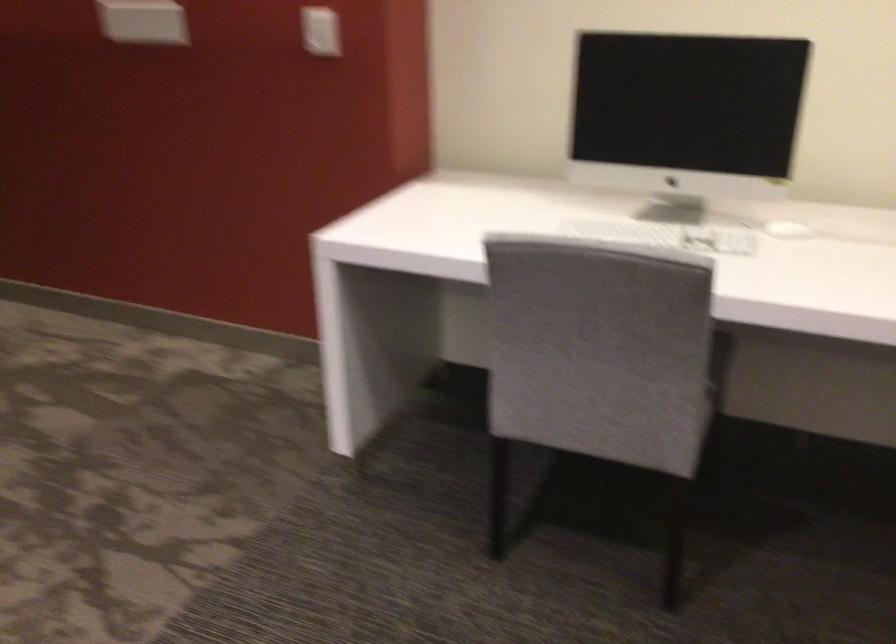
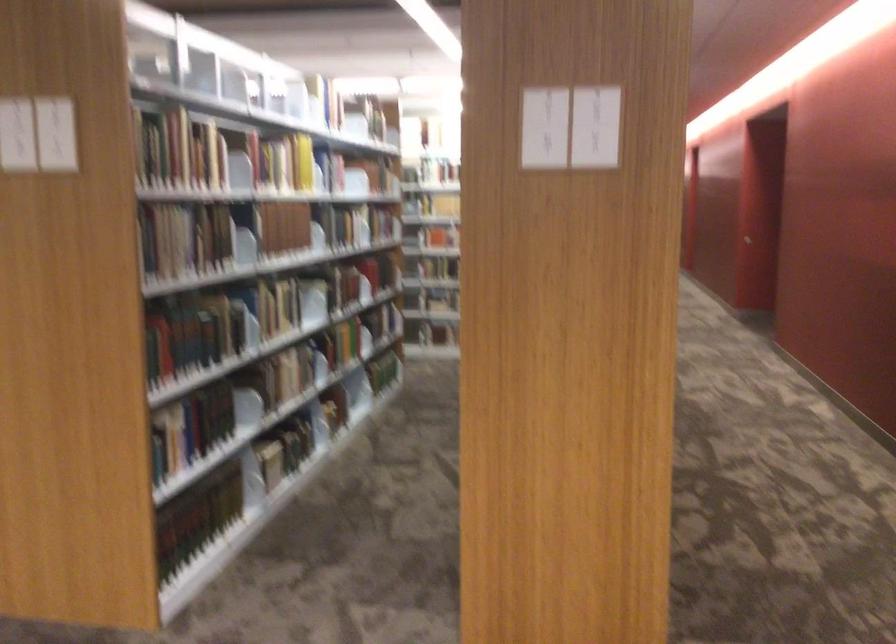
Question: The first image is from the beginning of the video and the second image is from the end. How did the camera likely rotate when shooting the video?

Choices:
 (A) Left
 (B) Right
 (C) Up
 (D) Down

Answer: (A)